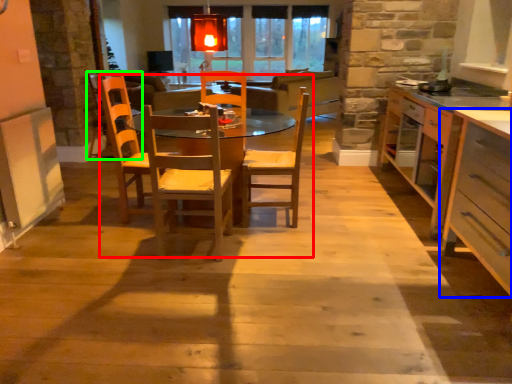
Question: Based on their relative distances, which object is farther from kitchen & dining room table (highlighted by a red box)? Choose from cabinetry (highlighted by a blue box) and armchair (highlighted by a green box).

Choices:
 (A) cabinetry
 (B) armchair

Answer: (B)